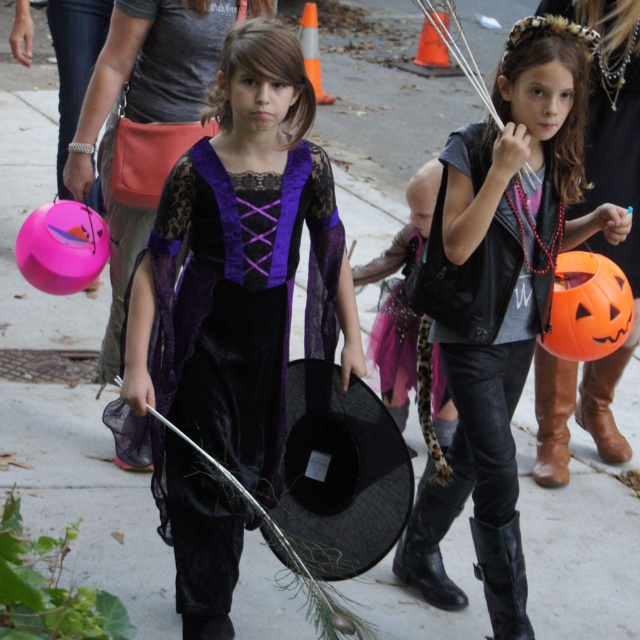
Question: Can you confirm if velvet purple dress at center is positioned above orange matte pumpkin at right?

Choices:
 (A) no
 (B) yes

Answer: (A)

Question: Which of these objects is positioned closest to the velvet black hat at center?

Choices:
 (A) velvet purple dress at center
 (B) orange matte pumpkin at right
 (C) matte black vest at center

Answer: (C)

Question: Among these objects, which one is farthest from the camera?

Choices:
 (A) orange matte pumpkin at right
 (B) matte black vest at center

Answer: (A)

Question: Which point appears farthest from the camera in this image?

Choices:
 (A) (577, 260)
 (B) (380, 358)
 (C) (308, 83)

Answer: (B)

Question: Can you confirm if velvet purple dress at center is positioned to the right of velvet black hat at center?

Choices:
 (A) yes
 (B) no

Answer: (B)

Question: Observing the image, what is the correct spatial positioning of velvet purple dress at center in reference to matte black vest at center?

Choices:
 (A) left
 (B) right

Answer: (A)